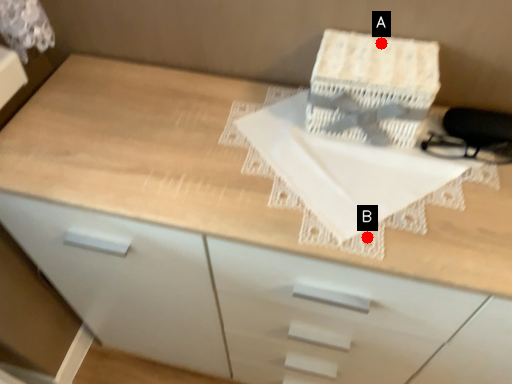
Question: Two points are circled on the image, labeled by A and B beside each circle. Which point is closer to the camera?

Choices:
 (A) A is closer
 (B) B is closer

Answer: (B)